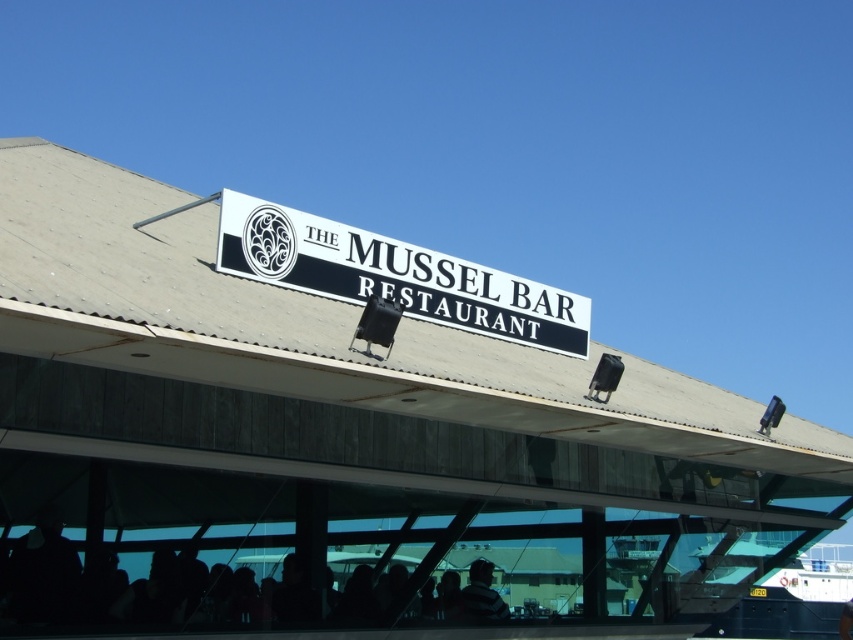
You are a customer standing in front of the restaurant and want to read the white plastic sign at center but you are blocked by the dark gray sweater at lower center. Can you move to your right to see the sign?

The white plastic sign at center is to the left of the dark gray sweater at lower center, so moving to your right would take you away from the sign. You should move to your left instead to see the sign.

You are a customer arriving at The Mussel Bar Restaurant and want to find the entrance. You see the silhouette skin at lower center and the white plastic sign at center. Which object is closer to the entrance?

The silhouette skin at lower center is closer to the entrance because it is wider than the white plastic sign at center, suggesting it is positioned in front of the entrance area.